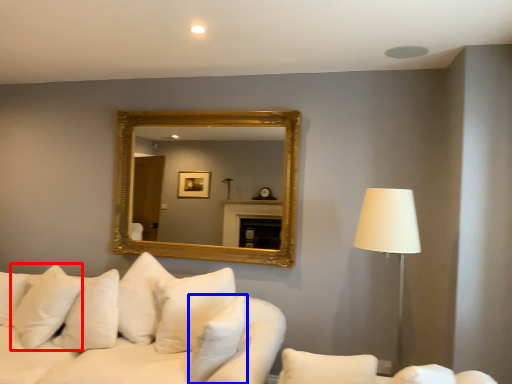
Question: Which object appears farthest to the camera in this image, pillow (highlighted by a red box) or pillow (highlighted by a blue box)?

Choices:
 (A) pillow
 (B) pillow

Answer: (A)